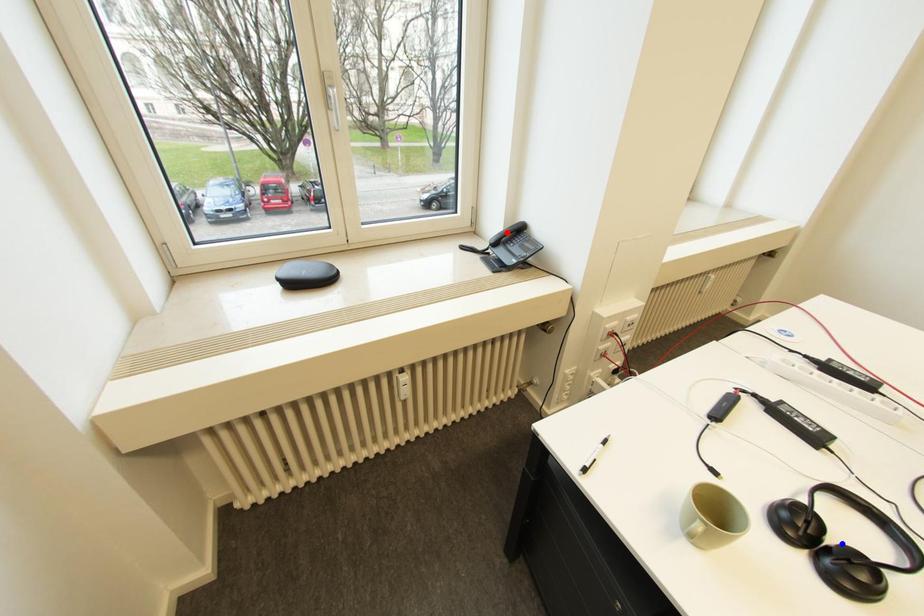
Question: Two points are marked on the image. Which point is closer to the camera?

Choices:
 (A) Blue point is closer.
 (B) Red point is closer.

Answer: (A)